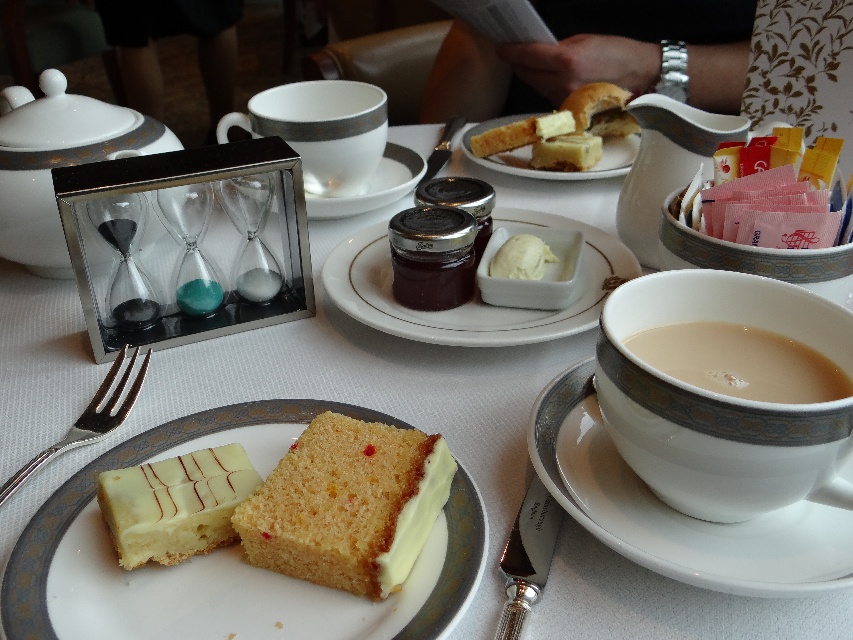
You are a guest at this tea party and want to reach for the white ceramic saucer at right without moving your arm too far. Which direction should you move your hand from the yellow sponge cake at center to get it?

The white ceramic saucer at right is to the right of the yellow sponge cake at center, so you should move your hand to the right from the yellow sponge cake at center to reach the white ceramic saucer at right.

You are a tea enthusiast who wants to reach for the creamy porcelain cup at right while holding the white glossy cake at center. Can you comfortably hold both items without spilling the tea?

The creamy porcelain cup at right and white glossy cake at center are 8.98 inches apart. Since the distance between them is more than 8 inches, you can comfortably hold both items without spilling the tea.

You are a guest at this tea party and want to reach for the matte glass jar at center. Considering your arm length is 24 inches, can you comfortably reach it without moving your chair?

The matte glass jar at center is 18.21 inches away from the viewer. Since your arm length is 24 inches, which is longer than the distance, you can comfortably reach it without moving your chair.